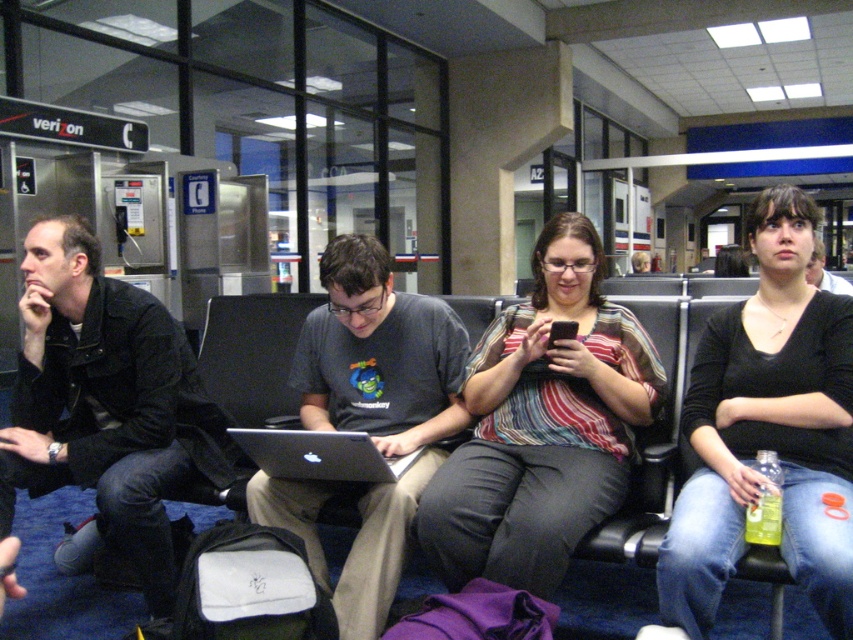
Does striped fabric shirt at center have a smaller size compared to silver/black plastic laptop at center?

No.

Who is more distant from viewer, [538,560] or [361,445]?

The point [361,445] is behind.

Locate an element on the screen. This screenshot has width=853, height=640. striped fabric shirt at center is located at coordinates (543, 426).

Describe the element at coordinates (543, 426) in the screenshot. The image size is (853, 640). I see `striped fabric shirt at center` at that location.

Does striped fabric shirt at center have a larger size compared to black leather jacket at left?

Yes.

Is point (541, 346) more distant than point (26, 472)?

No, it is not.

Image resolution: width=853 pixels, height=640 pixels. Identify the location of striped fabric shirt at center. (543, 426).

Between black leather jacket at left and matte gray shirt at center, which one has less height?

Standing shorter between the two is matte gray shirt at center.

Does black leather jacket at left lie behind matte gray shirt at center?

Yes, it is behind matte gray shirt at center.

This screenshot has height=640, width=853. What do you see at coordinates (108, 403) in the screenshot?
I see `black leather jacket at left` at bounding box center [108, 403].

You are a GUI agent. You are given a task and a screenshot of the screen. Output one action in this format:
    pyautogui.click(x=<x>, y=<y>)
    Task: Click on the black leather jacket at left
    This screenshot has height=640, width=853.
    Given the screenshot: What is the action you would take?
    click(108, 403)